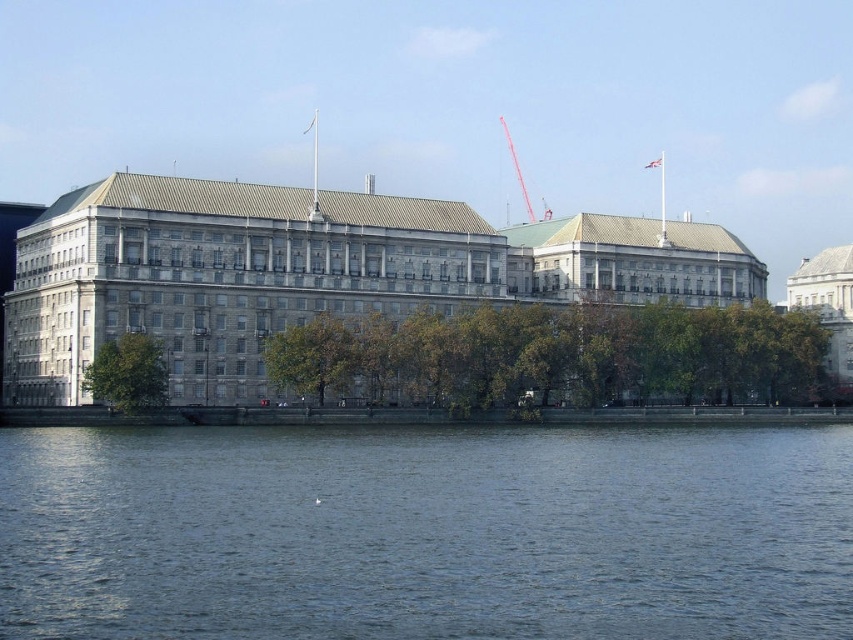
You are a construction worker tasked with installing a safety barrier between the blue water at lower center and the gray stone building at center. The safety barrier requires a minimum of 20 meters of space to be effective. Based on the scene, can the barrier be installed effectively?

The distance between the blue water at lower center and the gray stone building at center is 25.11 meters, which exceeds the required 20 meters. Therefore, the safety barrier can be installed effectively.

You are standing on the dock and want to know which object is taller between the blue water at lower center and the gray stone building at center. Which one is taller?

The gray stone building at center is taller than the blue water at lower center.